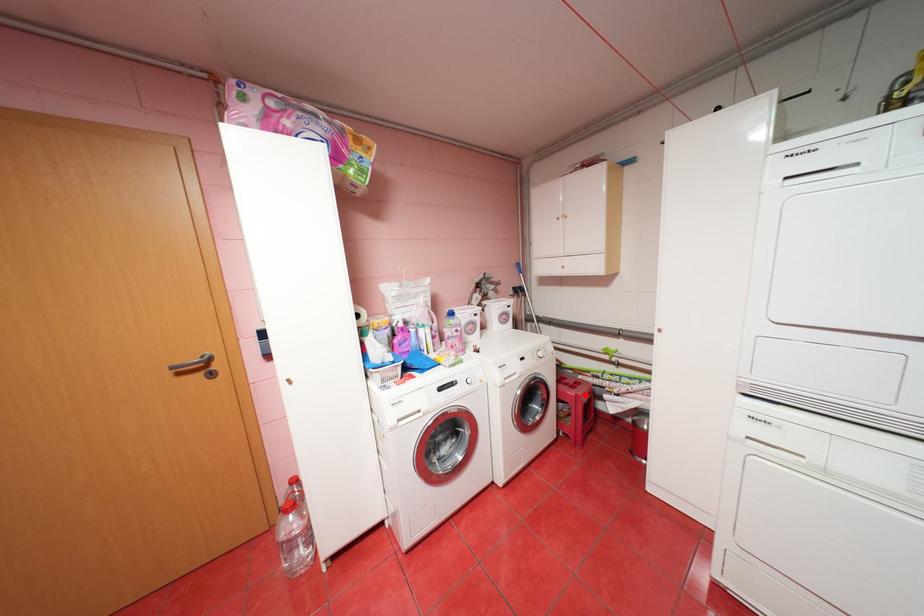
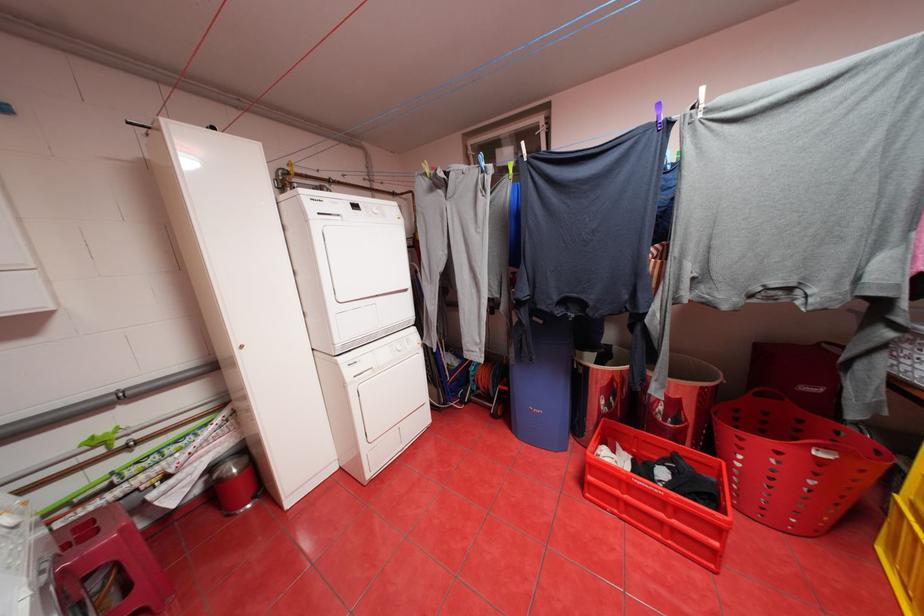
Question: A red point is marked in image1. In image2, is the corresponding 3D point closer to the camera or farther? Reply with the corresponding letter.

Choices:
 (A) The corresponding 3D point is closer.
 (B) The corresponding 3D point is farther.

Answer: (B)